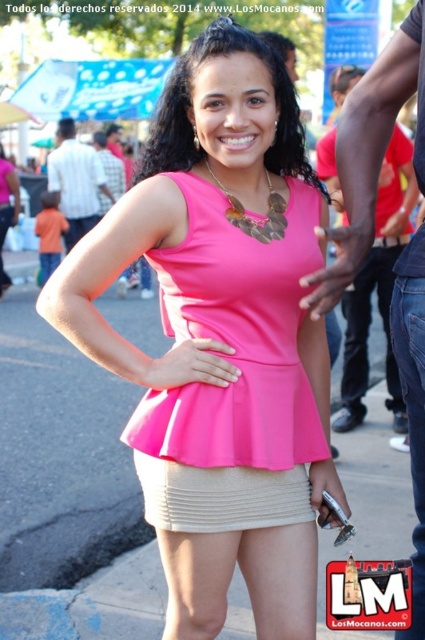
You are a photographer who wants to take a picture of the pink matte peplum top at center. Your camera is 2.19 meters away from the top. Is the distance within the camera lens focus range of 2 meters? Please answer yes or no.

The pink matte peplum top at center and camera are 2.19 meters apart, which is slightly beyond the 2 meters focus range. The answer is no.

In the scene shown: You are a fashion designer observing the outfit of the central figure in the scene. Based on the description, can you determine which piece of clothing is longer in vertical length between the pink matte top at center and the beige ribbed miniskirt at center?

The pink matte top at center is taller than the beige ribbed miniskirt at center, so the pink matte top at center is longer in vertical length.

You are a fashion designer observing the scene. You notice the pink matte top at center and the pink matte peplum top at center. Which one appears taller in the image?

The pink matte top at center appears taller than the pink matte peplum top at center.